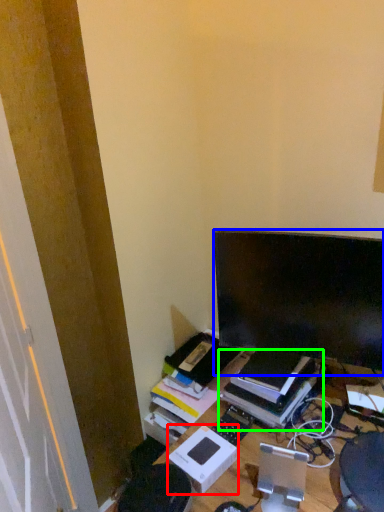
Question: Which object is the closest to the cardboard box (highlighted by a red box)? Choose among these: computer monitor (highlighted by a blue box) or book (highlighted by a green box).

Choices:
 (A) computer monitor
 (B) book

Answer: (B)